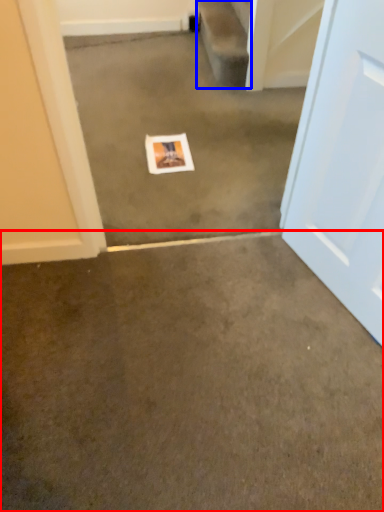
Question: Which object appears closest to the camera in this image, concrete (highlighted by a red box) or stairwell (highlighted by a blue box)?

Choices:
 (A) concrete
 (B) stairwell

Answer: (A)